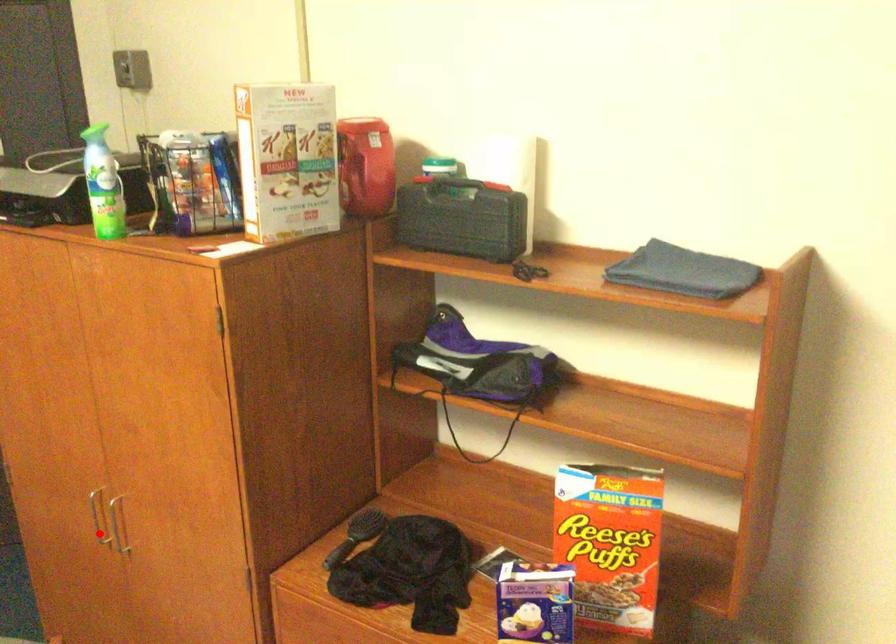
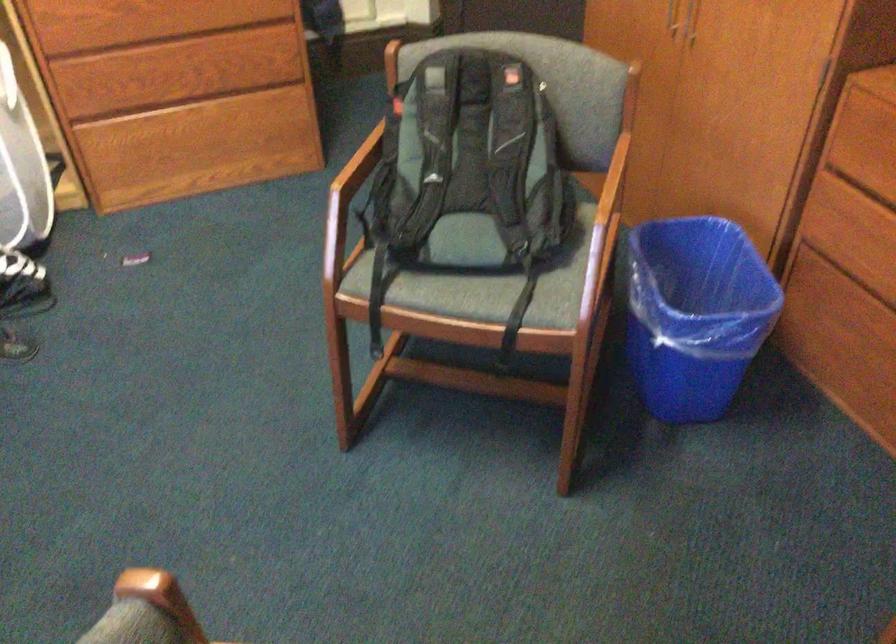
Find the pixel in the second image that matches the highlighted location in the first image.

(670, 17)